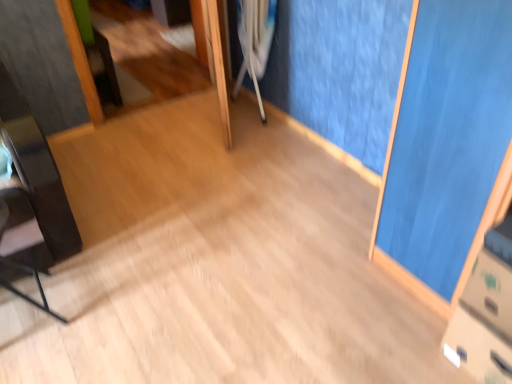
Question: From a real-world perspective, relative to matte black chair at left, is white plastic crutch at center vertically above or below?

Choices:
 (A) above
 (B) below

Answer: (A)

Question: Would you say white plastic crutch at center is inside or outside matte black chair at left?

Choices:
 (A) inside
 (B) outside

Answer: (B)

Question: From the image's perspective, is white plastic crutch at center above or below matte black chair at left?

Choices:
 (A) above
 (B) below

Answer: (A)

Question: Does point (6, 221) appear closer or farther from the camera than point (246, 34)?

Choices:
 (A) farther
 (B) closer

Answer: (B)

Question: In the image, is matte black chair at left positioned in front of or behind white plastic crutch at center?

Choices:
 (A) behind
 (B) front

Answer: (B)

Question: From a real-world perspective, relative to white plastic crutch at center, is matte black chair at left vertically above or below?

Choices:
 (A) below
 (B) above

Answer: (A)

Question: Is matte black chair at left bigger or smaller than white plastic crutch at center?

Choices:
 (A) big
 (B) small

Answer: (B)